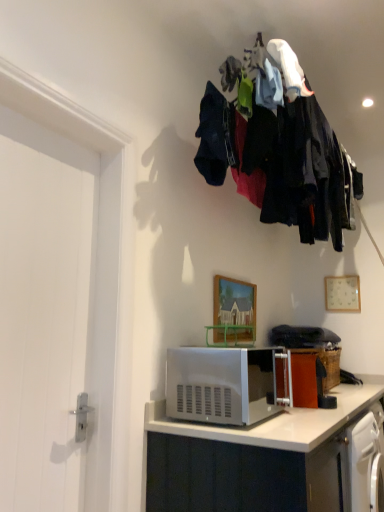
Question: Which direction should I rotate to face wooden painted picture frame at center, the first picture frame positioned from the left, — up or down?

Choices:
 (A) up
 (B) down

Answer: (B)

Question: Is silver metallic microwave at lower center turned away from satin silver microwave at lower center?

Choices:
 (A) no
 (B) yes

Answer: (A)

Question: From a real-world perspective, is silver metallic microwave at lower center beneath satin silver microwave at lower center?

Choices:
 (A) no
 (B) yes

Answer: (B)

Question: Can you confirm if silver metallic microwave at lower center is wider than satin silver microwave at lower center?

Choices:
 (A) no
 (B) yes

Answer: (B)

Question: Is silver metallic microwave at lower center next to satin silver microwave at lower center and touching it?

Choices:
 (A) yes
 (B) no

Answer: (B)

Question: Considering the relative sizes of silver metallic microwave at lower center and satin silver microwave at lower center in the image provided, is silver metallic microwave at lower center thinner than satin silver microwave at lower center?

Choices:
 (A) no
 (B) yes

Answer: (A)

Question: Does silver metallic microwave at lower center appear on the right side of satin silver microwave at lower center?

Choices:
 (A) no
 (B) yes

Answer: (B)

Question: From the image's perspective, is white smooth door at left located beneath satin silver microwave at lower center?

Choices:
 (A) no
 (B) yes

Answer: (A)

Question: Are white smooth door at left and satin silver microwave at lower center making contact?

Choices:
 (A) yes
 (B) no

Answer: (B)

Question: Considering the relative sizes of white smooth door at left and satin silver microwave at lower center in the image provided, is white smooth door at left wider than satin silver microwave at lower center?

Choices:
 (A) yes
 (B) no

Answer: (B)

Question: Is white smooth door at left far from satin silver microwave at lower center?

Choices:
 (A) yes
 (B) no

Answer: (B)

Question: Considering the relative sizes of white smooth door at left and satin silver microwave at lower center in the image provided, is white smooth door at left smaller than satin silver microwave at lower center?

Choices:
 (A) no
 (B) yes

Answer: (A)

Question: Is the depth of white smooth door at left greater than that of satin silver microwave at lower center?

Choices:
 (A) no
 (B) yes

Answer: (A)

Question: From a real-world perspective, is wooden painted picture frame at center, the first picture frame positioned from the left, physically above satin silver microwave at lower center?

Choices:
 (A) yes
 (B) no

Answer: (A)